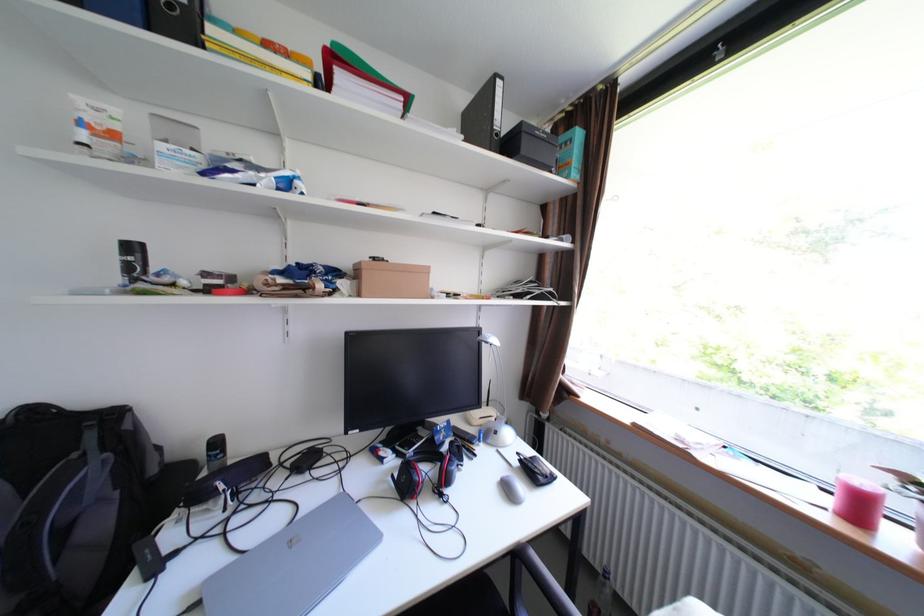
Where would you lift the black computer mouse? Please return your answer as a coordinate pair (x, y).

(512, 488)